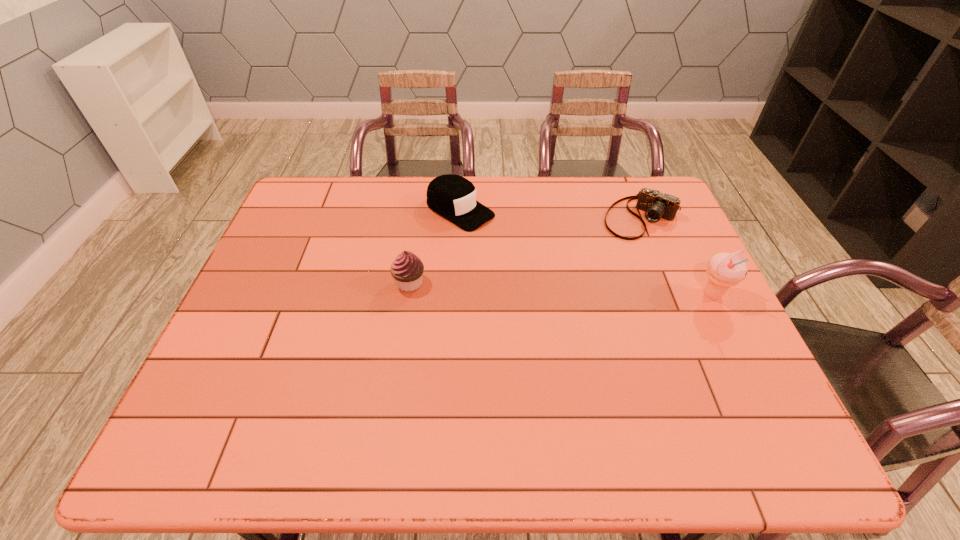
Image resolution: width=960 pixels, height=540 pixels. I want to click on blank area located on the front-facing side of the cap, so click(562, 271).

This screenshot has height=540, width=960. Find the location of `free space located 0.260m on the front-facing side of the cap`. free space located 0.260m on the front-facing side of the cap is located at coordinates 553,266.

The height and width of the screenshot is (540, 960). Find the location of `camera that is at the far edge`. camera that is at the far edge is located at coordinates (656, 205).

Where is `cap at the far edge`? cap at the far edge is located at coordinates (453, 197).

This screenshot has width=960, height=540. Find the location of `icecream that is at the right edge`. icecream that is at the right edge is located at coordinates (724, 270).

The height and width of the screenshot is (540, 960). Identify the location of camera at the right edge. point(656,205).

Where is `object positioned at the far right corner`? This screenshot has height=540, width=960. object positioned at the far right corner is located at coordinates (656, 205).

Where is `vacant area at the far edge of the desktop`? The height and width of the screenshot is (540, 960). vacant area at the far edge of the desktop is located at coordinates (514, 213).

At what (x,y) coordinates should I click in order to perform the action: click on vacant area at the near edge. Please return your answer as a coordinate pair (x, y). Looking at the image, I should click on 347,375.

Locate an element on the screen. vacant space at the left edge of the desktop is located at coordinates (269, 281).